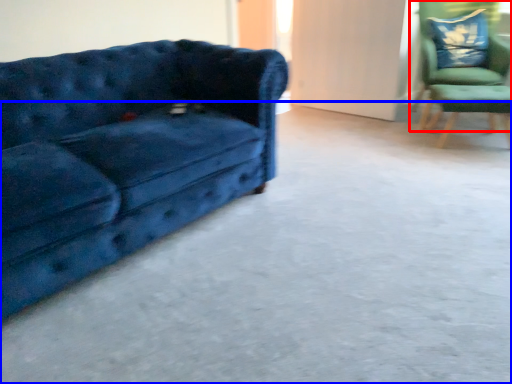
Question: Which object appears farthest to the camera in this image, chair (highlighted by a red box) or concrete (highlighted by a blue box)?

Choices:
 (A) chair
 (B) concrete

Answer: (A)